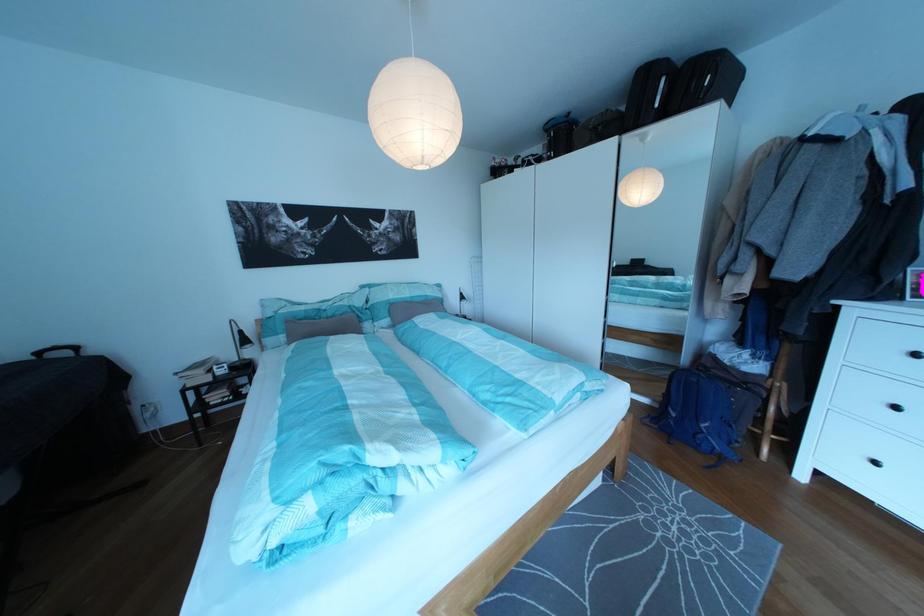
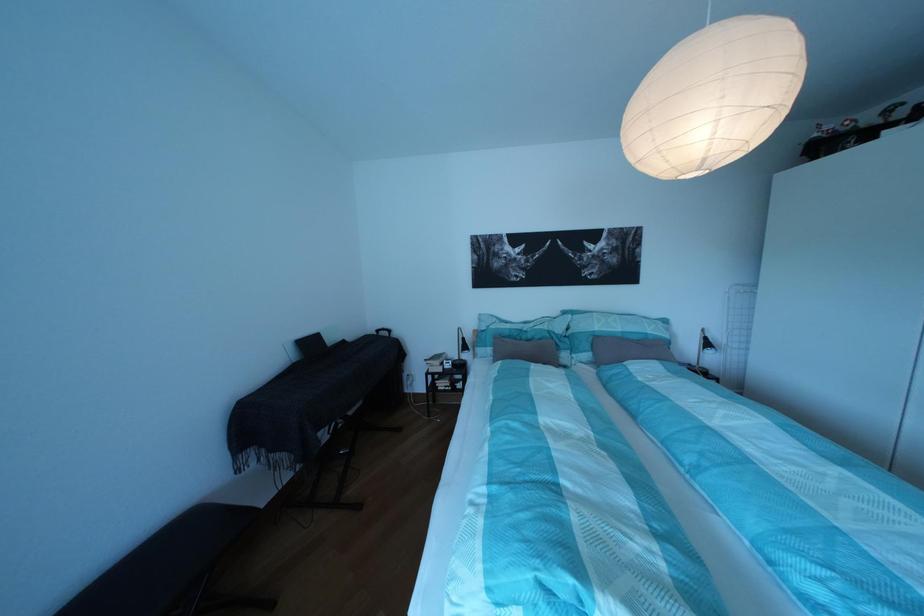
In the second image, find the point that corresponds to pixel 190 379 in the first image.

(439, 367)